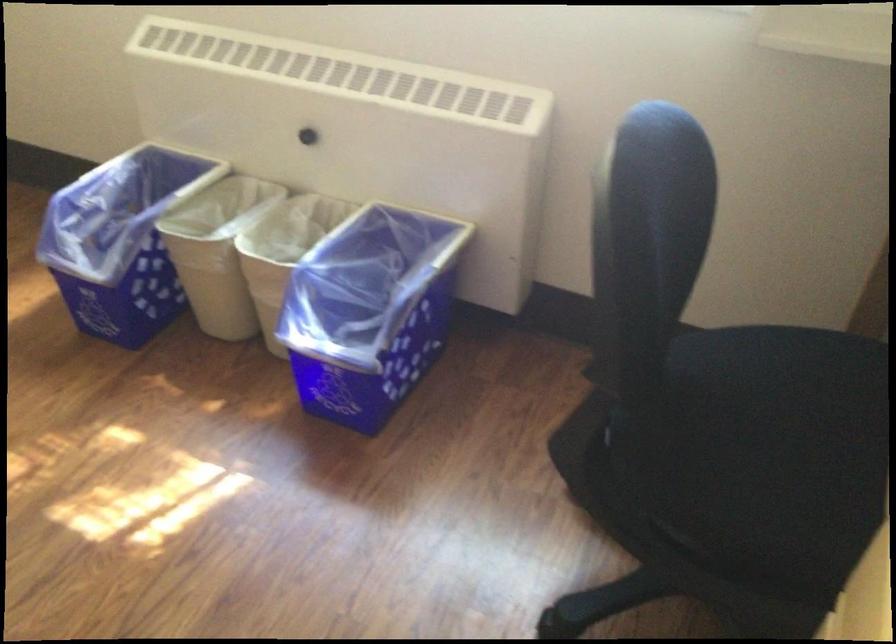
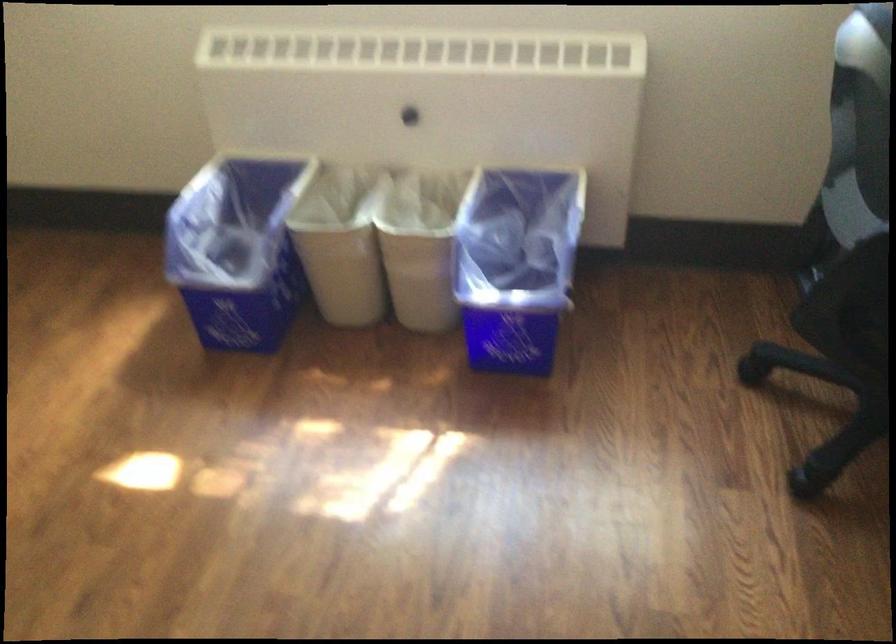
The point at (599, 474) is marked in the first image. Where is the corresponding point in the second image?

(848, 334)